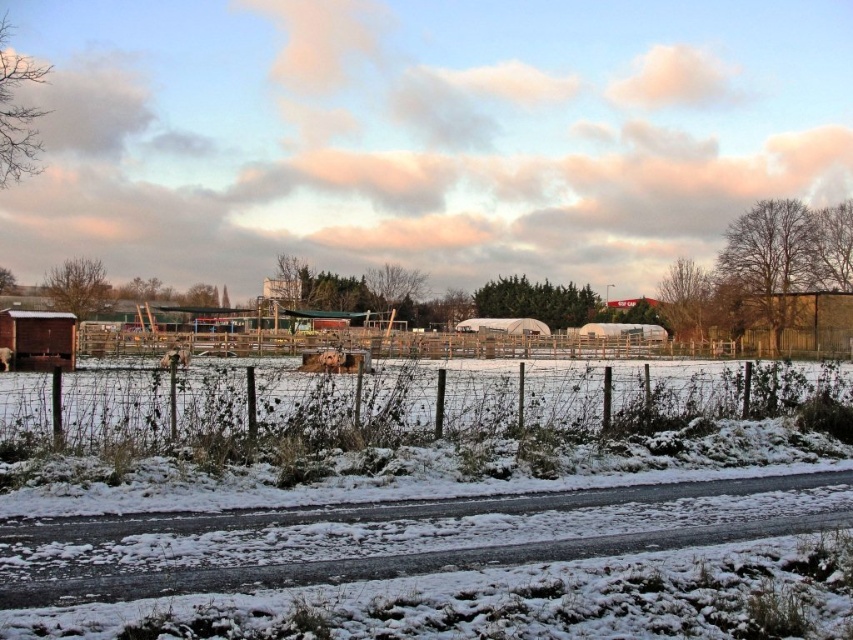
You are standing at the point marked as point (x=537, y=346) in the image. What is the nearest object to you?

The nearest object to you is the wooden fence at center, as the point (x=537, y=346) is located on it.

You are standing at the point marked by point (x=115, y=408). What is the nearest object to you?

The nearest object to you is the snow covered grass at center, which is represented by point (x=115, y=408).